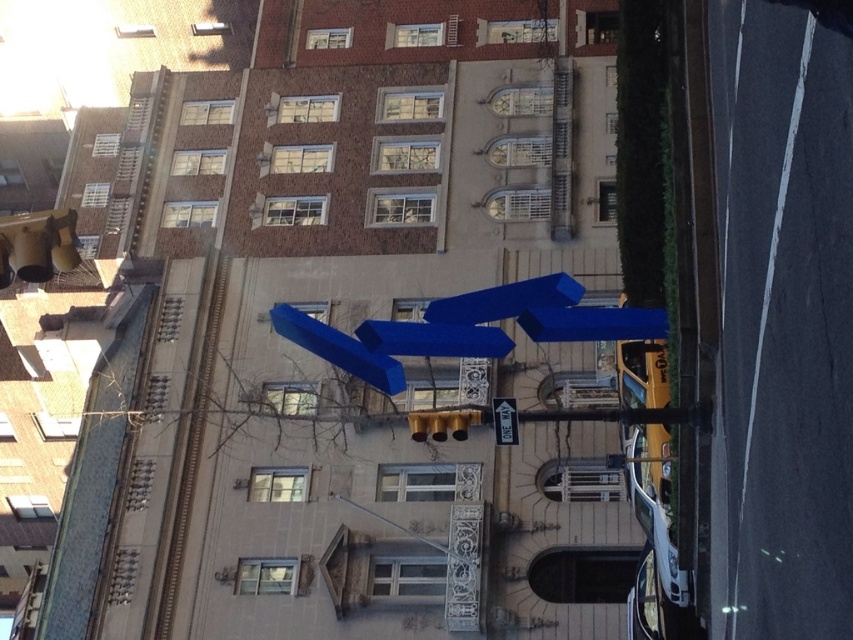
Consider the image. Who is taller, blue matte sculpture at center or white plastic one way sign at center?

With more height is blue matte sculpture at center.

Does blue matte sculpture at center have a larger size compared to white plastic one way sign at center?

Yes, blue matte sculpture at center is bigger than white plastic one way sign at center.

Where is `blue matte sculpture at center`? Image resolution: width=853 pixels, height=640 pixels. blue matte sculpture at center is located at coordinates (505, 300).

Which is in front, point (506, 340) or point (485, 310)?

Positioned in front is point (506, 340).

Does blue matte arrow at center have a smaller size compared to blue matte sculpture at center?

Indeed, blue matte arrow at center has a smaller size compared to blue matte sculpture at center.

Is point (413, 324) positioned in front of point (469, 301)?

Yes, point (413, 324) is in front of point (469, 301).

Image resolution: width=853 pixels, height=640 pixels. I want to click on blue matte arrow at center, so click(433, 339).

Does blue glossy arrow at center have a lesser height compared to white plastic one way sign at center?

No, blue glossy arrow at center is not shorter than white plastic one way sign at center.

Consider the image. How distant is blue glossy arrow at center from white plastic one way sign at center?

A distance of 7.80 meters exists between blue glossy arrow at center and white plastic one way sign at center.

Which is behind, point (376, 384) or point (495, 420)?

Positioned behind is point (376, 384).

You are a GUI agent. You are given a task and a screenshot of the screen. Output one action in this format:
    pyautogui.click(x=<x>, y=<y>)
    Task: Click on the blue glossy arrow at center
    This screenshot has width=853, height=640.
    Given the screenshot: What is the action you would take?
    pyautogui.click(x=338, y=348)